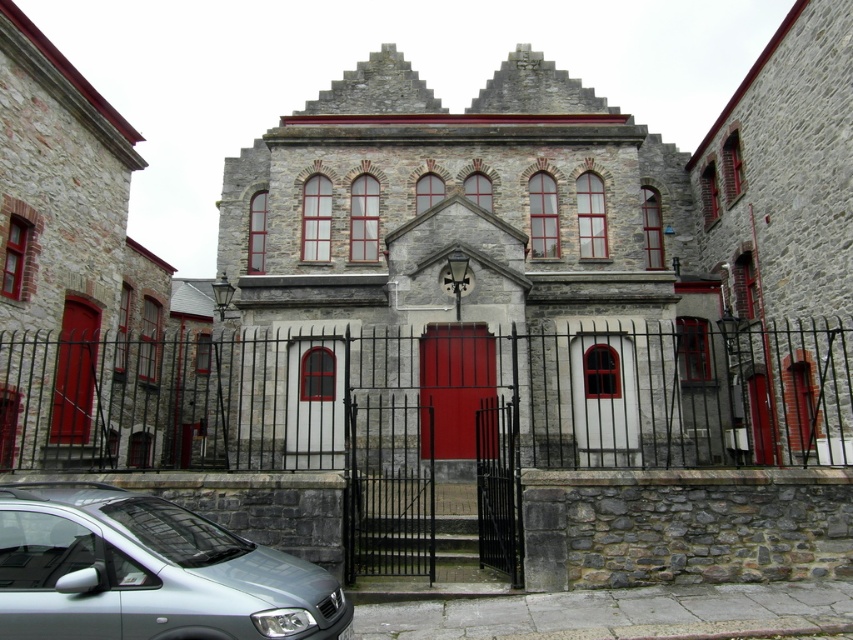
Question: Which object is positioned farthest from the smooth red door at left?

Choices:
 (A) smooth glossy red door at center
 (B) matte wood door at center

Answer: (B)

Question: Is satin silver car at lower left closer to the viewer compared to matte wood door at center?

Choices:
 (A) no
 (B) yes

Answer: (B)

Question: Based on their relative distances, which object is nearer to the matte wood door at center?

Choices:
 (A) satin silver car at lower left
 (B) smooth red door at left
 (C) smooth glossy red door at center

Answer: (C)

Question: Based on their relative distances, which object is farther from the smooth red door at left?

Choices:
 (A) matte wood door at center
 (B) satin silver car at lower left
 (C) smooth glossy red door at center

Answer: (A)

Question: Can you confirm if smooth glossy red door at center is positioned to the right of matte wood door at center?

Choices:
 (A) no
 (B) yes

Answer: (A)

Question: Does smooth glossy red door at center appear over matte wood door at center?

Choices:
 (A) no
 (B) yes

Answer: (B)